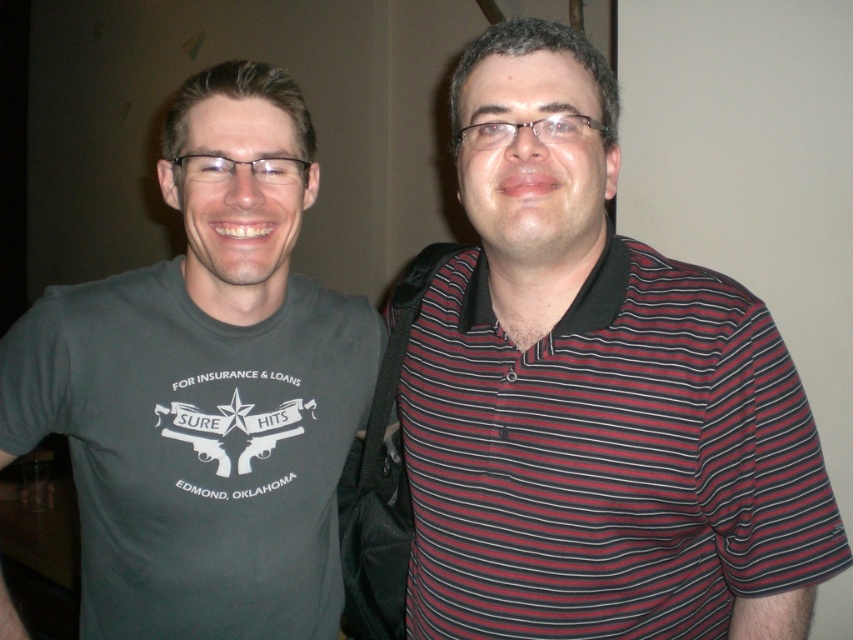
Question: Which object appears closest to the camera in this image?

Choices:
 (A) striped cotton polo shirt at right
 (B) dark gray t-shirt at left

Answer: (A)

Question: Which point is closer to the camera taking this photo?

Choices:
 (A) (648, 632)
 (B) (355, 346)

Answer: (A)

Question: Which point is closer to the camera?

Choices:
 (A) (91, 433)
 (B) (703, 333)

Answer: (B)

Question: Is striped cotton polo shirt at right smaller than dark gray t-shirt at left?

Choices:
 (A) no
 (B) yes

Answer: (B)

Question: Considering the relative positions of striped cotton polo shirt at right and dark gray t-shirt at left in the image provided, where is striped cotton polo shirt at right located with respect to dark gray t-shirt at left?

Choices:
 (A) right
 (B) left

Answer: (A)

Question: Does striped cotton polo shirt at right appear on the left side of dark gray t-shirt at left?

Choices:
 (A) yes
 (B) no

Answer: (B)